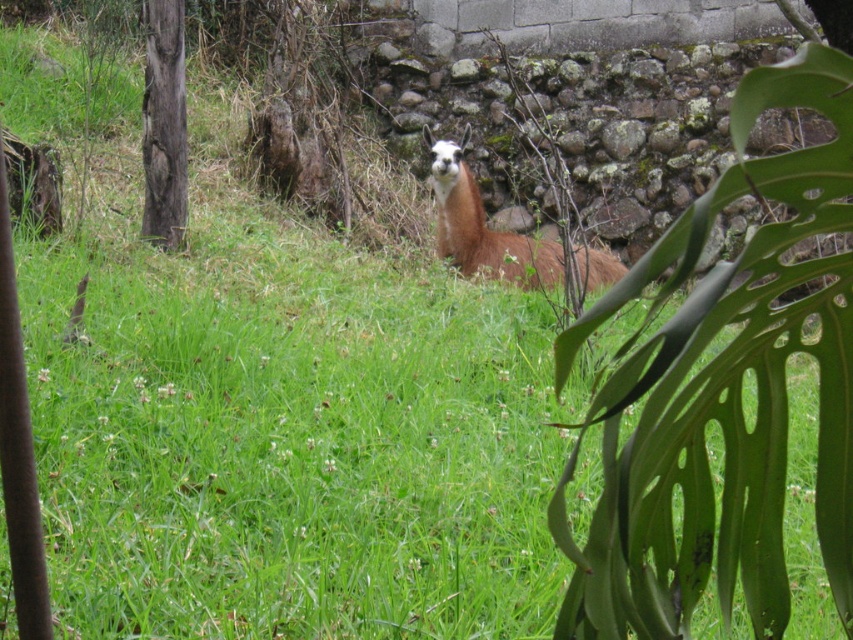
You are a hiker who wants to take a photo of the brown woolly alpaca at center and the dark brown rough bark tree at left. Since you want both in the frame, which direction should you move to ensure both are visible?

You should move to the left so that both the brown woolly alpaca at center and the dark brown rough bark tree at left are visible in your camera frame.

You are a hiker who wants to take a photo of the brown woolly alpaca at center and the dark brown rough bark tree at left. You have a camera with a 50mm lens that can focus up to 10 feet. Can you capture both subjects in focus without moving closer?

The brown woolly alpaca at center is 8.07 feet away from the dark brown rough bark tree at left. Since the camera can focus up to 10 feet, the distance between them is within the focus range. Therefore, you can capture both subjects in focus without moving closer.

You are a hiker who wants to take a photo of the brown woolly alpaca at center and the dark brown rough bark tree at left. Which object is closer to you, the photographer?

The brown woolly alpaca at center is positioned under the dark brown rough bark tree at left, so the alpaca is closer to you than the tree.